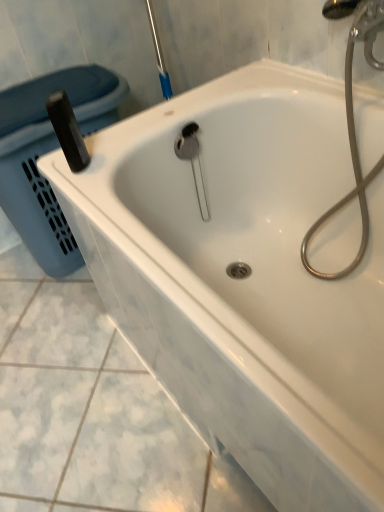
Question: Relative to blue plastic laundry basket at left, is metallic silver hose at upper right in front or behind?

Choices:
 (A) behind
 (B) front

Answer: (B)

Question: Looking at their shapes, would you say metallic silver hose at upper right is wider or thinner than blue plastic laundry basket at left?

Choices:
 (A) thin
 (B) wide

Answer: (A)

Question: Would you say metallic silver hose at upper right is inside or outside blue plastic laundry basket at left?

Choices:
 (A) outside
 (B) inside

Answer: (A)

Question: From the image's perspective, is blue plastic laundry basket at left above or below metallic silver hose at upper right?

Choices:
 (A) below
 (B) above

Answer: (B)

Question: Considering the positions of blue plastic laundry basket at left and metallic silver hose at upper right in the image, is blue plastic laundry basket at left wider or thinner than metallic silver hose at upper right?

Choices:
 (A) thin
 (B) wide

Answer: (B)

Question: From a real-world perspective, is blue plastic laundry basket at left positioned above or below metallic silver hose at upper right?

Choices:
 (A) above
 (B) below

Answer: (B)

Question: Is blue plastic laundry basket at left taller or shorter than metallic silver hose at upper right?

Choices:
 (A) short
 (B) tall

Answer: (A)